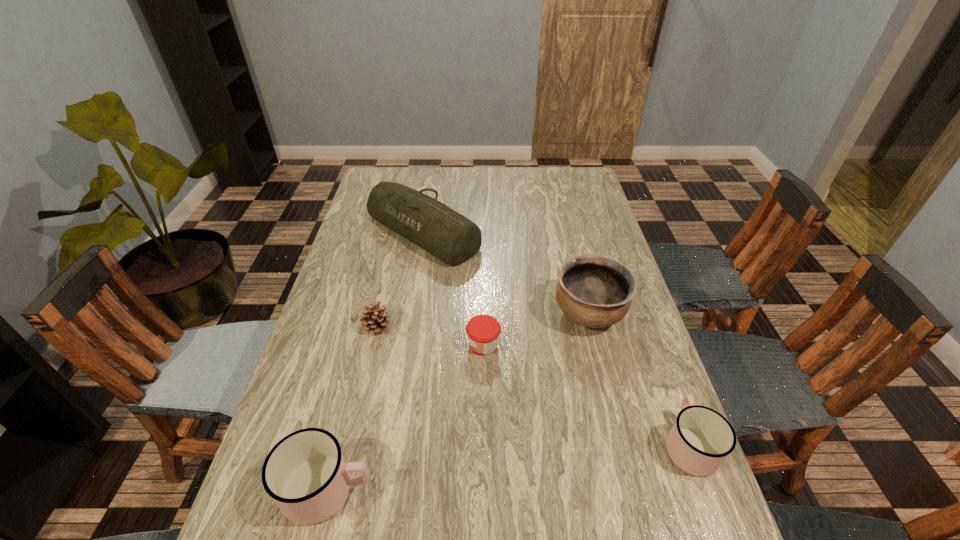
Identify which object is the fifth nearest to the left mug. Please provide its 2D coordinates. Your answer should be formatted as a tuple, i.e. [(x, y)], where the tuple contains the x and y coordinates of a point satisfying the conditions above.

[(700, 440)]

Locate an element on the screen. free space that satisfies the following two spatial constraints: 1. on the side of the right mug with the handle; 2. on the label side of the shortest object is located at coordinates 652,345.

The height and width of the screenshot is (540, 960). Identify the location of free spot that satisfies the following two spatial constraints: 1. on the front side of the pottery; 2. on the label side of the shortest object. (597, 345).

Locate an element on the screen. The width and height of the screenshot is (960, 540). free point that satisfies the following two spatial constraints: 1. on the side of the right mug with the handle; 2. on the label side of the shortest object is located at coordinates (652, 345).